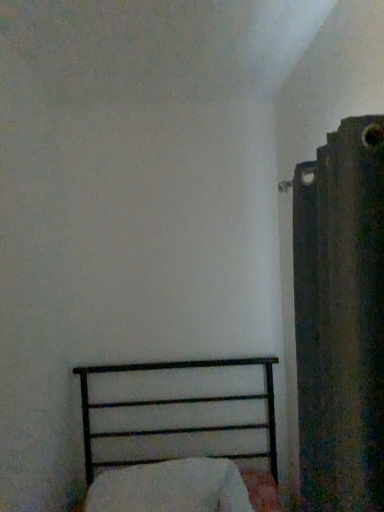
Question: In the image, is dark textured fabric at right positioned in front of or behind white soft pillow at lower center?

Choices:
 (A) front
 (B) behind

Answer: (A)

Question: Is dark textured fabric at right wider or thinner than white soft pillow at lower center?

Choices:
 (A) thin
 (B) wide

Answer: (A)

Question: Which object is positioned closest to the black metal bed at lower left?

Choices:
 (A) white soft pillow at lower center
 (B) dark textured fabric at right

Answer: (A)

Question: Considering the real-world distances, which object is closest to the dark textured fabric at right?

Choices:
 (A) white soft pillow at lower center
 (B) black metal bed at lower left

Answer: (A)